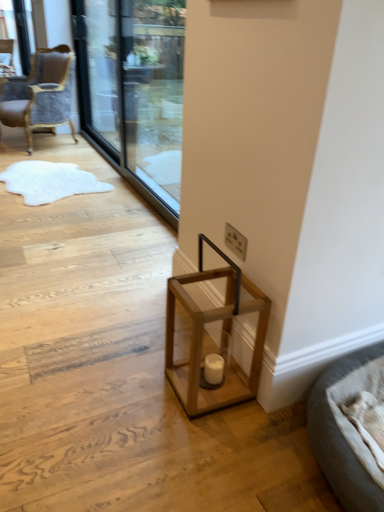
Question: Considering the relative positions of gray fabric bed at lower right and matte wooden candle holder at lower center in the image provided, is gray fabric bed at lower right to the left or to the right of matte wooden candle holder at lower center?

Choices:
 (A) right
 (B) left

Answer: (A)

Question: From the image's perspective, is gray fabric bed at lower right located above or below matte wooden candle holder at lower center?

Choices:
 (A) below
 (B) above

Answer: (A)

Question: Which object is positioned farthest from the velvet grey chair at upper left, the 1th chair in the bottom-to-top sequence?

Choices:
 (A) gray fabric bed at lower right
 (B) white plastic electric outlet at lower center
 (C) transparent glass screen door at upper left, the 1th screen door when ordered from left to right
 (D) velvet upholstered chair at upper left, which is the second chair in right-to-left order
 (E) matte wooden candle holder at lower center

Answer: (A)

Question: Based on their relative distances, which object is nearer to the white plastic electric outlet at lower center?

Choices:
 (A) transparent glass screen door at upper center, the 2th screen door viewed from the left
 (B) transparent glass screen door at upper left, the 1th screen door when ordered from left to right
 (C) matte wooden candle holder at lower center
 (D) wooden lantern at lower center
 (E) velvet grey chair at upper left, the 1th chair in the bottom-to-top sequence

Answer: (D)